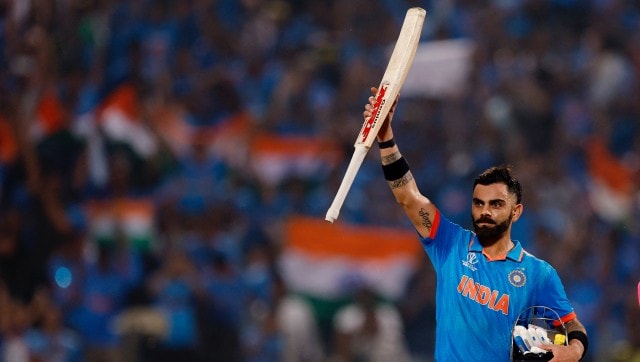
Image resolution: width=640 pixels, height=362 pixels. What are the coordinates of `handle` in the screenshot? It's located at (340, 191).